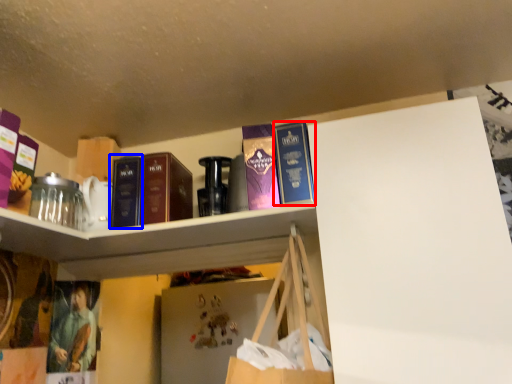
Question: Among these objects, which one is farthest to the camera, book (highlighted by a red box) or book (highlighted by a blue box)?

Choices:
 (A) book
 (B) book

Answer: (B)